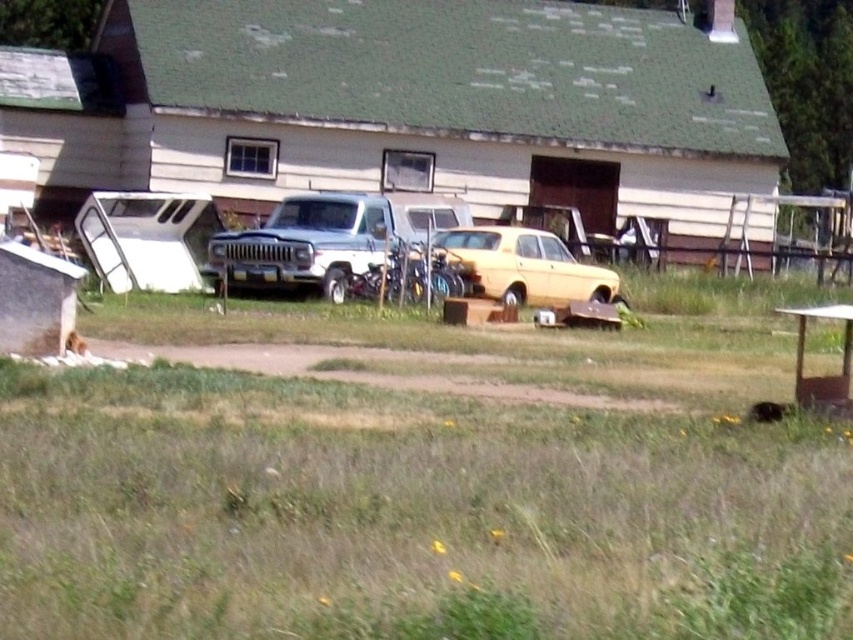
Question: Observing the image, what is the correct spatial positioning of green shingled shed at center in reference to yellow matte car at center?

Choices:
 (A) left
 (B) right

Answer: (A)

Question: Which point appears farthest from the camera in this image?

Choices:
 (A) (509, 234)
 (B) (102, 154)

Answer: (B)

Question: Which of the following is the farthest from the observer?

Choices:
 (A) yellow matte car at center
 (B) white matte truck at center

Answer: (B)

Question: Is green shingled shed at center wider than yellow matte car at center?

Choices:
 (A) no
 (B) yes

Answer: (B)

Question: Can you confirm if white matte truck at center is positioned above yellow matte car at center?

Choices:
 (A) no
 (B) yes

Answer: (B)

Question: Which of these objects is positioned farthest from the green shingled shed at center?

Choices:
 (A) white matte truck at center
 (B) yellow matte car at center

Answer: (B)